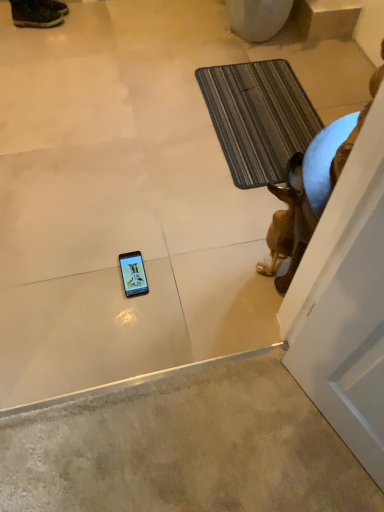
The image size is (384, 512). In order to click on blank area to the left of brown glossy statue at right in this screenshot , I will do pos(226,263).